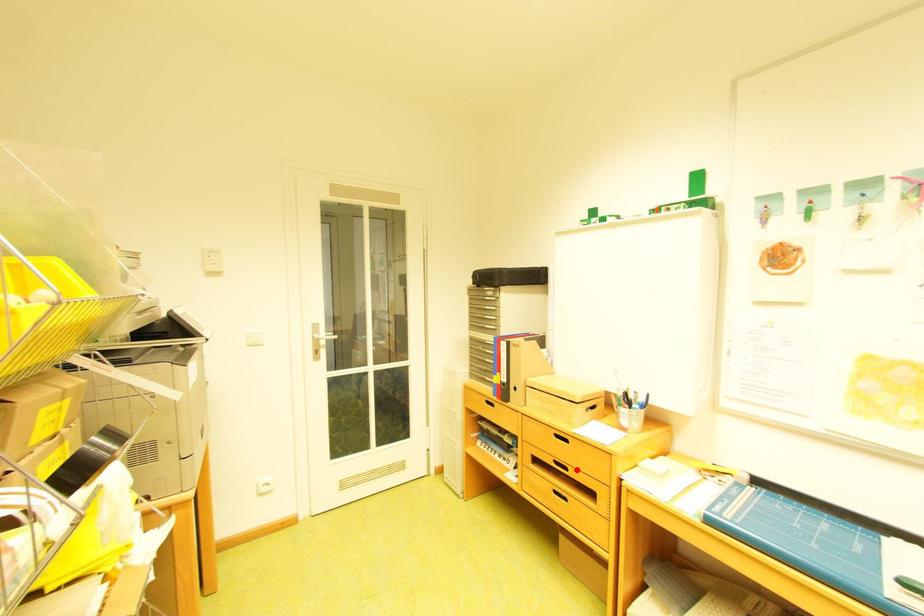
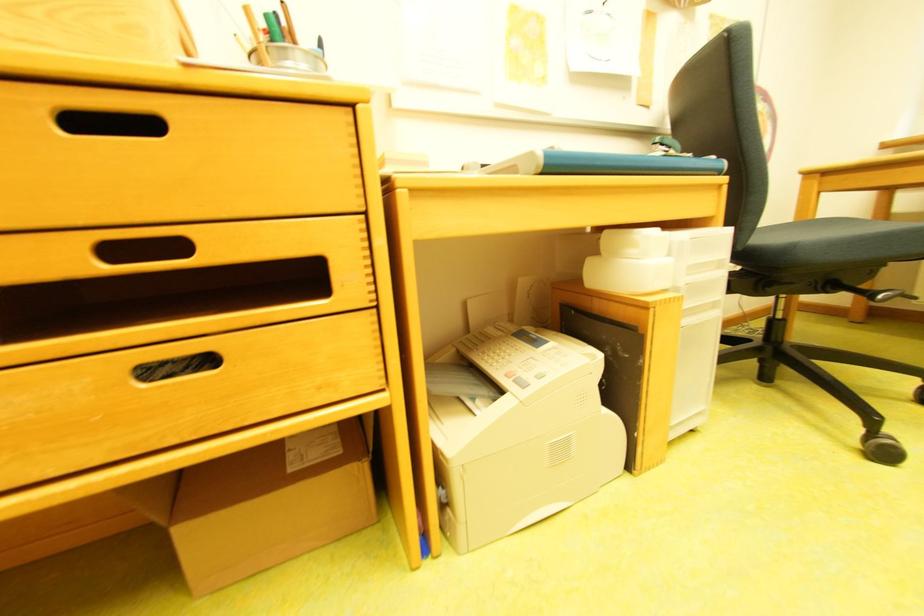
Question: I am providing you with two images of the same scene from different viewpoints. Given a red point in image1, look at the same physical point in image2. Is it:

Choices:
 (A) Closer to the viewpoint
 (B) Farther from the viewpoint

Answer: (A)